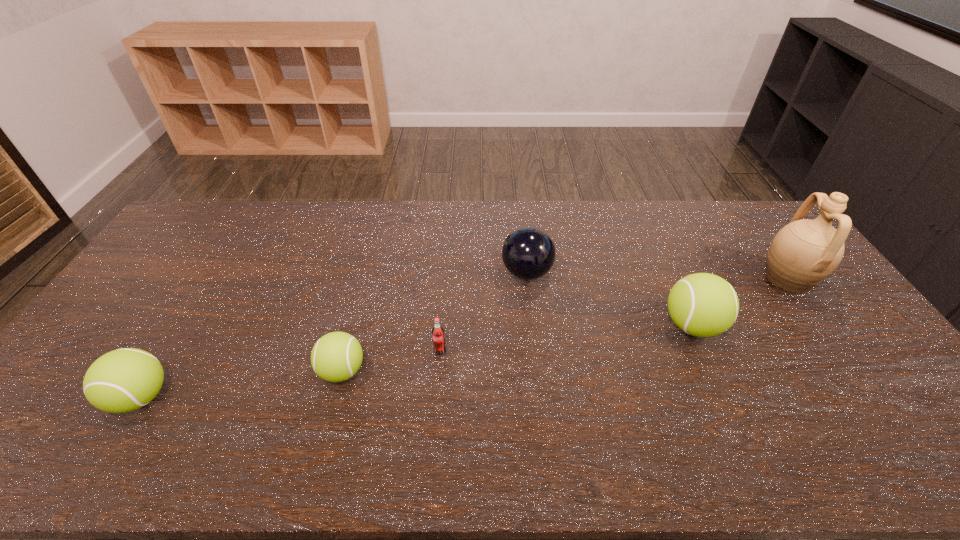
Find the location of a particular element. The image size is (960, 540). the leftmost tennis ball is located at coordinates (123, 380).

Image resolution: width=960 pixels, height=540 pixels. Find the location of `the second shortest tennis ball`. the second shortest tennis ball is located at coordinates (123, 380).

At what (x,y) coordinates should I click in order to perform the action: click on the second tennis ball from right to left. Please return your answer as a coordinate pair (x, y). The image size is (960, 540). Looking at the image, I should click on (337, 356).

This screenshot has height=540, width=960. In order to click on the fifth object from right to left in this screenshot , I will do [x=337, y=356].

At what (x,y) coordinates should I click in order to perform the action: click on the fifth object from left to right. Please return your answer as a coordinate pair (x, y). The width and height of the screenshot is (960, 540). Looking at the image, I should click on (704, 305).

Locate an element on the screen. The image size is (960, 540). the farthest tennis ball is located at coordinates (704, 305).

Identify the location of bowling ball. (528, 253).

At what (x,y) coordinates should I click in order to perform the action: click on the rightmost object. Please return your answer as a coordinate pair (x, y). This screenshot has height=540, width=960. Looking at the image, I should click on (804, 252).

At what (x,y) coordinates should I click in order to perform the action: click on pitcher. Please return your answer as a coordinate pair (x, y). The width and height of the screenshot is (960, 540). Looking at the image, I should click on (804, 252).

In order to click on soda bottle in this screenshot , I will do `click(438, 337)`.